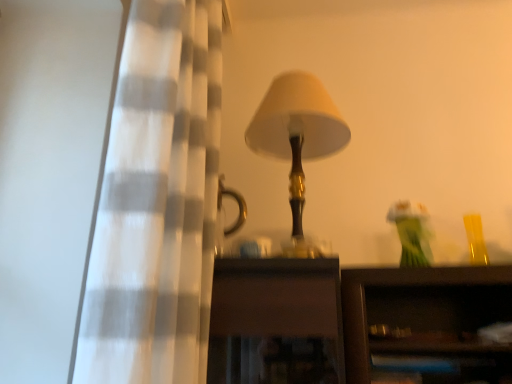
Question: Relative to translucent glass vase at upper right, is white checkered curtain at left in front or behind?

Choices:
 (A) front
 (B) behind

Answer: (A)

Question: From a real-world perspective, is white checkered curtain at left positioned above or below translucent glass vase at upper right?

Choices:
 (A) below
 (B) above

Answer: (B)

Question: Which of these objects is positioned closest to the translucent glass vase at upper right?

Choices:
 (A) white checkered curtain at left
 (B) matte gold lamp at center

Answer: (B)

Question: Considering the real-world distances, which object is farthest from the white checkered curtain at left?

Choices:
 (A) matte gold lamp at center
 (B) translucent glass vase at upper right

Answer: (B)